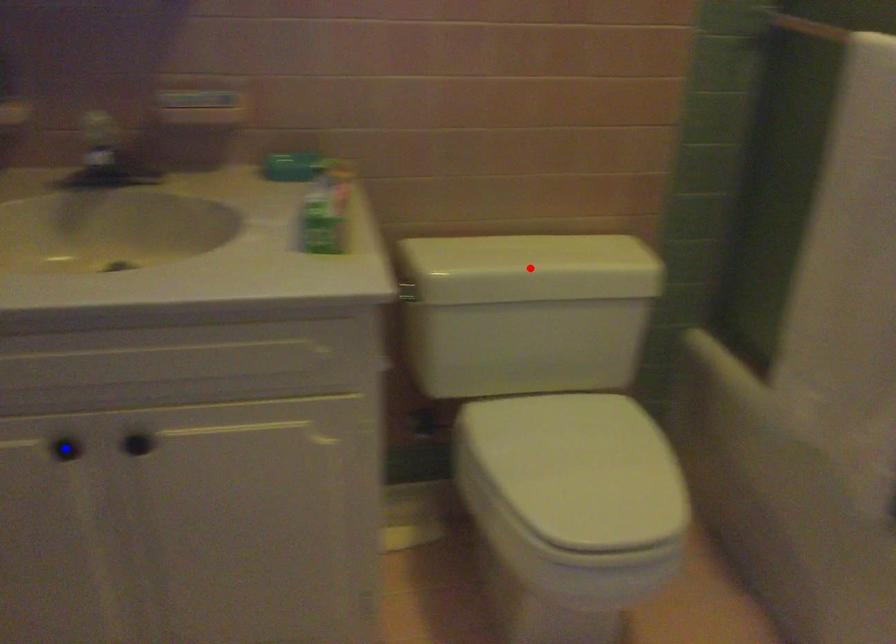
Question: In the image, two points are highlighted. Which point is nearer to the camera? Reply with the corresponding letter.

Choices:
 (A) blue point
 (B) red point

Answer: (A)